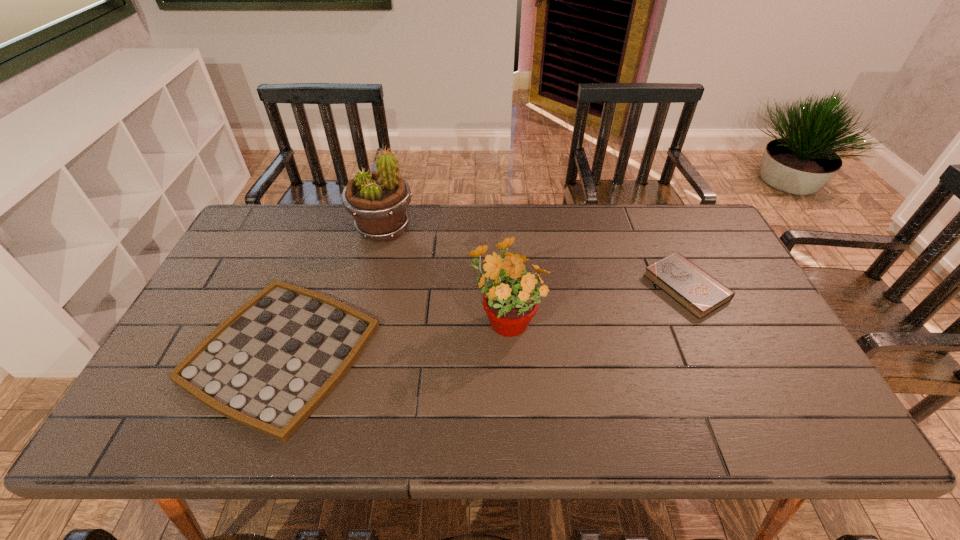
In order to click on the left flowerpot in this screenshot , I will do `click(377, 200)`.

This screenshot has width=960, height=540. What are the coordinates of `the farther flowerpot` in the screenshot? It's located at (377, 200).

I want to click on the second object from right to left, so click(511, 300).

In order to click on the right flowerpot in this screenshot , I will do `click(511, 300)`.

Identify the location of the second shortest object. (693, 288).

Where is `Bible`? Bible is located at coordinates (693, 288).

You are a GUI agent. You are given a task and a screenshot of the screen. Output one action in this format:
    pyautogui.click(x=<x>, y=<y>)
    Task: Click on the shortest object
    This screenshot has height=540, width=960.
    Given the screenshot: What is the action you would take?
    pyautogui.click(x=268, y=366)

At what (x,y) coordinates should I click in order to perform the action: click on vacant area located on the right of the farthest object. Please return your answer as a coordinate pair (x, y). This screenshot has width=960, height=540. Looking at the image, I should click on (432, 230).

Identify the location of vacant space positioned on the right of the right flowerpot. The width and height of the screenshot is (960, 540). (670, 317).

Identify the location of free space located on the back of the second shortest object. This screenshot has height=540, width=960. (654, 215).